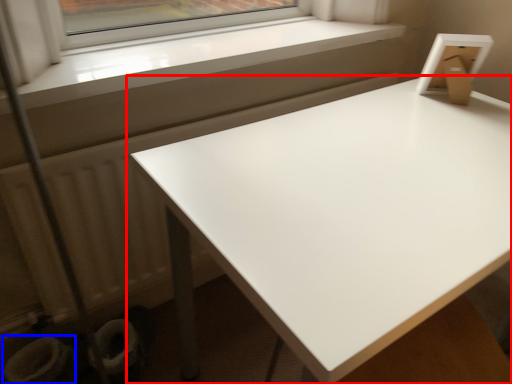
Question: Which of the following is the farthest to the observer, table (highlighted by a red box) or toilet bowl (highlighted by a blue box)?

Choices:
 (A) table
 (B) toilet bowl

Answer: (B)